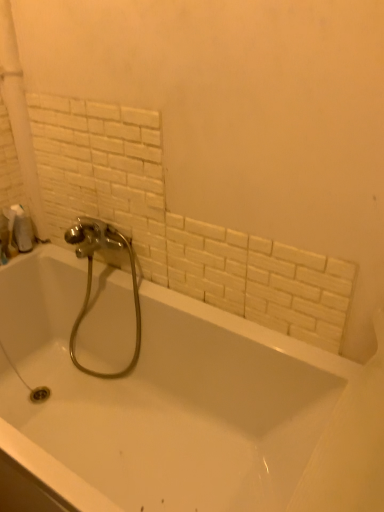
Question: From a real-world perspective, is white glossy bathtub at center below white matte toilet paper at left?

Choices:
 (A) yes
 (B) no

Answer: (A)

Question: Is white glossy bathtub at center at the left side of white matte toilet paper at left?

Choices:
 (A) no
 (B) yes

Answer: (A)

Question: Is white glossy bathtub at center aimed at white matte toilet paper at left?

Choices:
 (A) yes
 (B) no

Answer: (B)

Question: Is white glossy bathtub at center further to camera compared to white matte toilet paper at left?

Choices:
 (A) yes
 (B) no

Answer: (B)

Question: Does white glossy bathtub at center have a smaller size compared to white matte toilet paper at left?

Choices:
 (A) yes
 (B) no

Answer: (B)

Question: Considering the relative positions of white matte toilet paper at left and white glossy bathtub at center in the image provided, is white matte toilet paper at left to the left or to the right of white glossy bathtub at center?

Choices:
 (A) left
 (B) right

Answer: (A)

Question: From a real-world perspective, is white matte toilet paper at left positioned above or below white glossy bathtub at center?

Choices:
 (A) above
 (B) below

Answer: (A)

Question: Considering the positions of white matte toilet paper at left and white glossy bathtub at center in the image, is white matte toilet paper at left bigger or smaller than white glossy bathtub at center?

Choices:
 (A) big
 (B) small

Answer: (B)

Question: Looking at their shapes, would you say white matte toilet paper at left is wider or thinner than white glossy bathtub at center?

Choices:
 (A) thin
 (B) wide

Answer: (A)

Question: In the image, is chrome metallic faucet at center positioned in front of or behind white matte toilet paper at left?

Choices:
 (A) behind
 (B) front

Answer: (B)

Question: In terms of height, does chrome metallic faucet at center look taller or shorter compared to white matte toilet paper at left?

Choices:
 (A) short
 (B) tall

Answer: (B)

Question: In the image, is chrome metallic faucet at center on the left side or the right side of white matte toilet paper at left?

Choices:
 (A) right
 (B) left

Answer: (A)

Question: From the image's perspective, is chrome metallic faucet at center positioned above or below white matte toilet paper at left?

Choices:
 (A) above
 (B) below

Answer: (B)

Question: In terms of height, does chrome metallic faucet at center look taller or shorter compared to white glossy bathtub at center?

Choices:
 (A) tall
 (B) short

Answer: (A)

Question: From a real-world perspective, is chrome metallic faucet at center positioned above or below white glossy bathtub at center?

Choices:
 (A) below
 (B) above

Answer: (B)